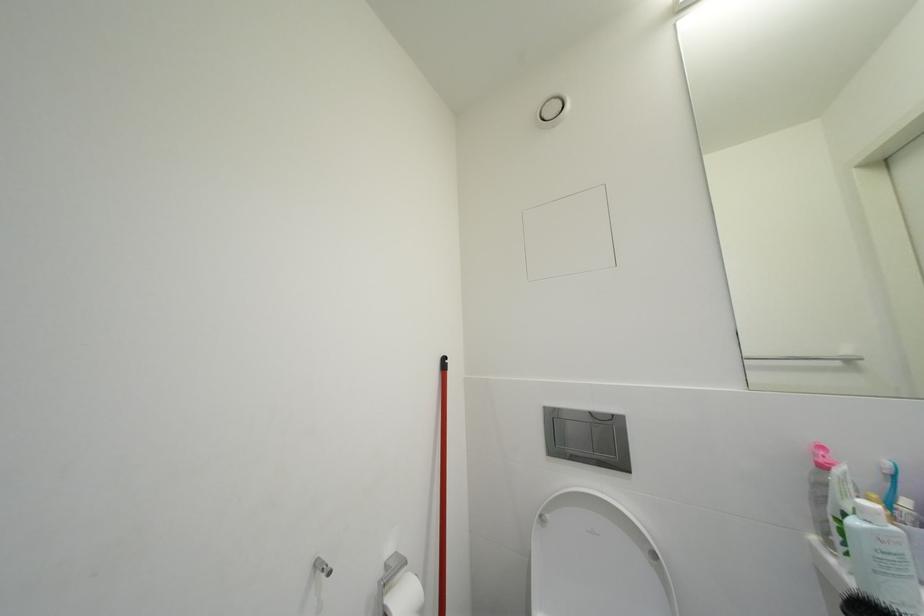
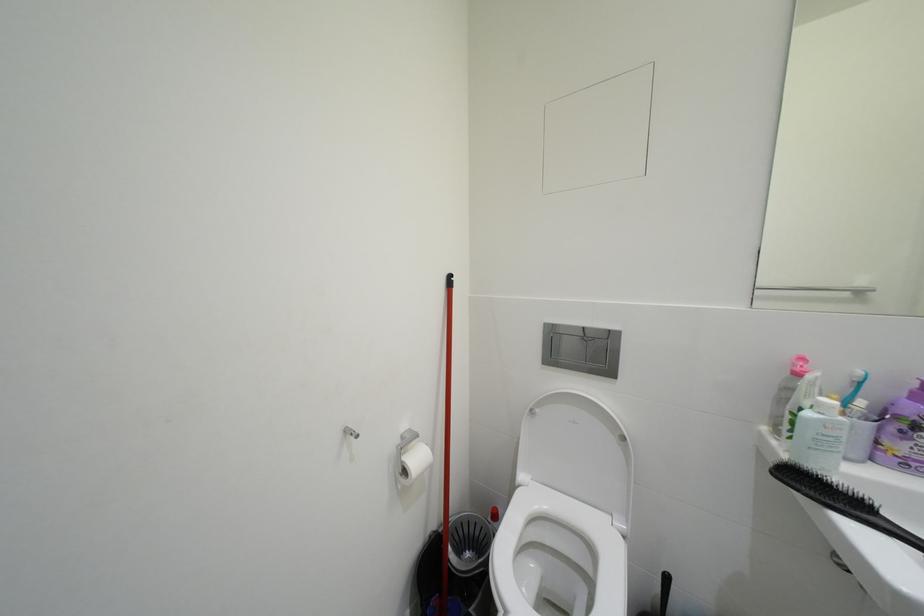
Question: Based on the continuous images, in which direction is the camera rotating? Reply with the corresponding letter.

Choices:
 (A) Left
 (B) Right
 (C) Up
 (D) Down

Answer: (D)